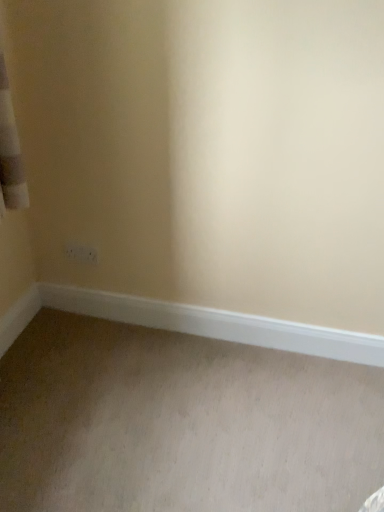
Question: Considering the relative sizes of white smooth baseboard at lower center and beige carpet at lower left in the image provided, is white smooth baseboard at lower center wider than beige carpet at lower left?

Choices:
 (A) yes
 (B) no

Answer: (B)

Question: Can you confirm if white smooth baseboard at lower center is taller than beige carpet at lower left?

Choices:
 (A) yes
 (B) no

Answer: (A)

Question: From a real-world perspective, is white smooth baseboard at lower center on top of beige carpet at lower left?

Choices:
 (A) no
 (B) yes

Answer: (B)

Question: Is the depth of white smooth baseboard at lower center greater than that of beige carpet at lower left?

Choices:
 (A) yes
 (B) no

Answer: (A)

Question: Considering the relative sizes of white smooth baseboard at lower center and beige carpet at lower left in the image provided, is white smooth baseboard at lower center smaller than beige carpet at lower left?

Choices:
 (A) yes
 (B) no

Answer: (A)

Question: Is white smooth baseboard at lower center next to beige carpet at lower left and touching it?

Choices:
 (A) no
 (B) yes

Answer: (A)

Question: Is beige carpet at lower left to the right of white smooth baseboard at lower center from the viewer's perspective?

Choices:
 (A) yes
 (B) no

Answer: (B)

Question: Is beige carpet at lower left smaller than white smooth baseboard at lower center?

Choices:
 (A) no
 (B) yes

Answer: (A)

Question: Is beige carpet at lower left thinner than white smooth baseboard at lower center?

Choices:
 (A) yes
 (B) no

Answer: (B)

Question: Is beige carpet at lower left far from white smooth baseboard at lower center?

Choices:
 (A) yes
 (B) no

Answer: (B)

Question: Is beige carpet at lower left placed right next to white smooth baseboard at lower center?

Choices:
 (A) yes
 (B) no

Answer: (B)

Question: Is beige carpet at lower left positioned before white smooth baseboard at lower center?

Choices:
 (A) no
 (B) yes

Answer: (B)

Question: From the image's perspective, is white smooth baseboard at lower center above or below beige carpet at lower left?

Choices:
 (A) below
 (B) above

Answer: (B)